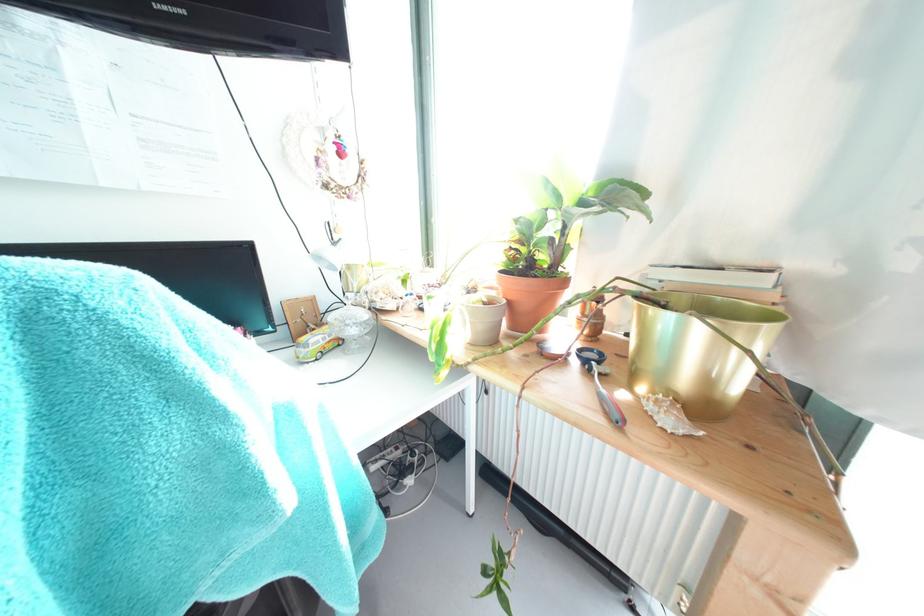
This screenshot has width=924, height=616. I want to click on terracotta plant pot, so click(x=529, y=299).